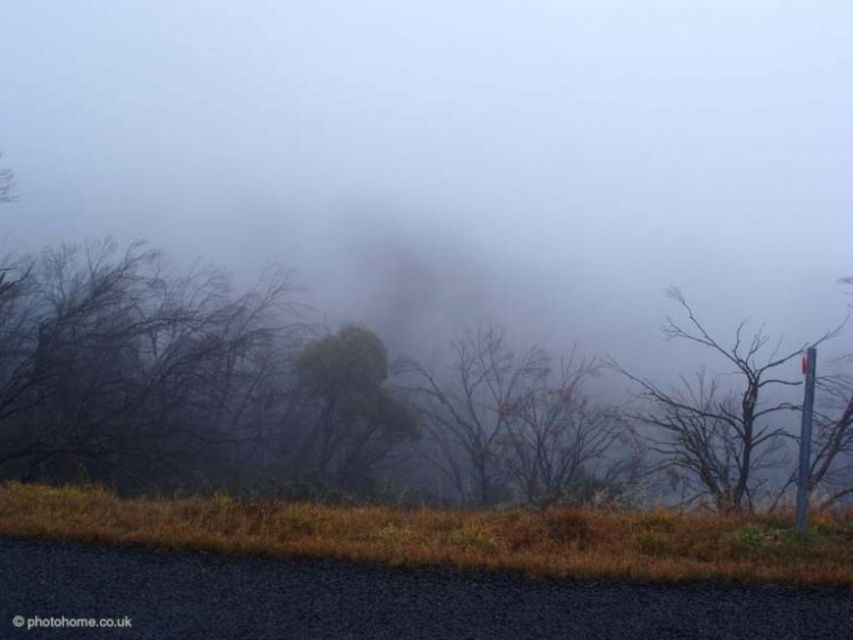
You are an observer standing in the misty landscape. You see the green matte tree at center and the smooth gray pole at right. Which object is closer to you?

The green matte tree at center is closer to you because the smooth gray pole at right is behind it.

You are a hiker in the misty landscape. You see the green matte tree at center and the metallic pole at right. Which object is positioned lower in the scene?

The green matte tree at center is positioned lower than the metallic pole at right.

You are a painter standing 10 meters away from the smooth gray pole at right and metallic pole at right. You want to paint both poles in a landscape painting. If your canvas can only capture objects within a 5 meter range, will both poles fit on the canvas?

The distance between the smooth gray pole at right and metallic pole at right is 6.45 meters. Since you are standing 10 meters away from both poles, the total distance from you to each pole is 10 meters. However, the canvas can only capture objects within a 5 meter range. Therefore, neither pole will fit on the canvas because they are both 10 meters away, exceeding the 5 meter limit.